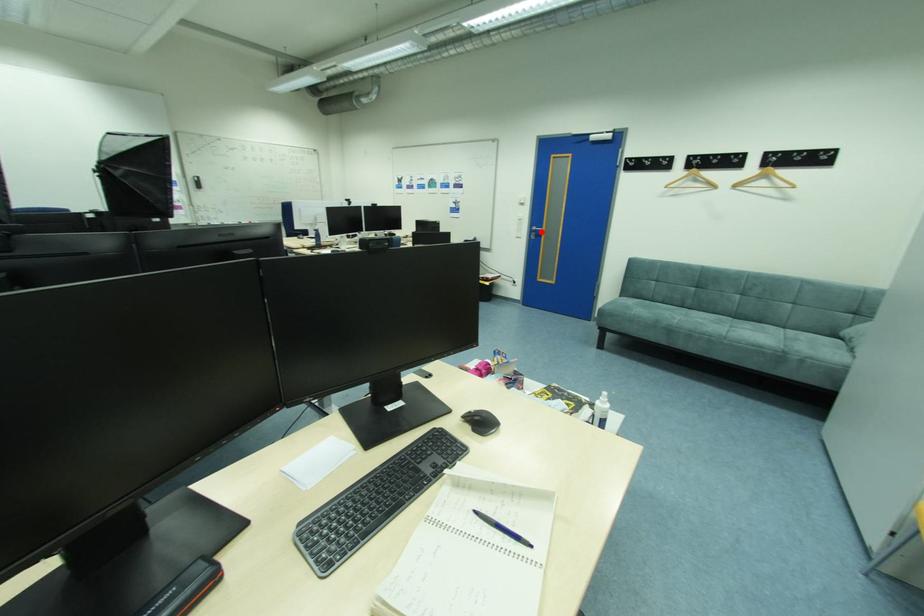
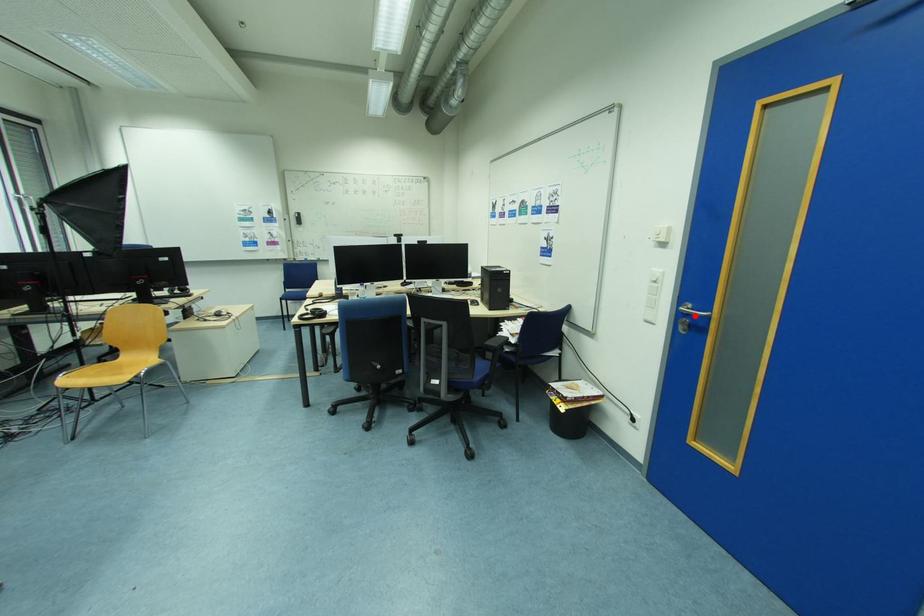
I am providing you with two images of the same scene from different viewpoints. A red point is marked on the first image and another point is marked on the second image. Is the marked point in image1 the same physical position as the marked point in image2?

Yes